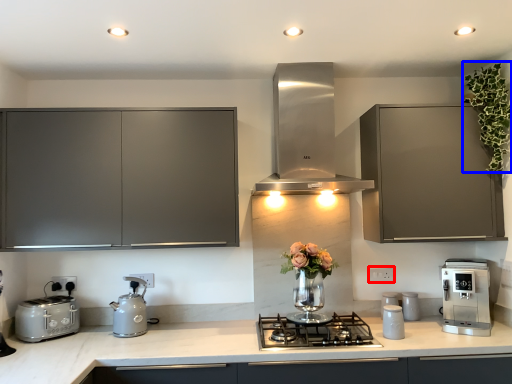
Question: Which object appears closest to the camera in this image, electric outlet (highlighted by a red box) or floral arrangement (highlighted by a blue box)?

Choices:
 (A) electric outlet
 (B) floral arrangement

Answer: (B)